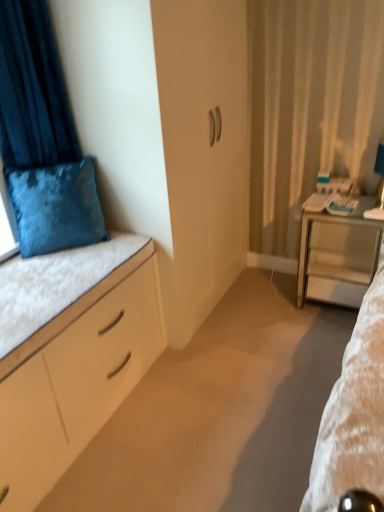
Locate an element on the screen. The image size is (384, 512). vacant space that is to the left of metallic silver desk at right is located at coordinates (283, 306).